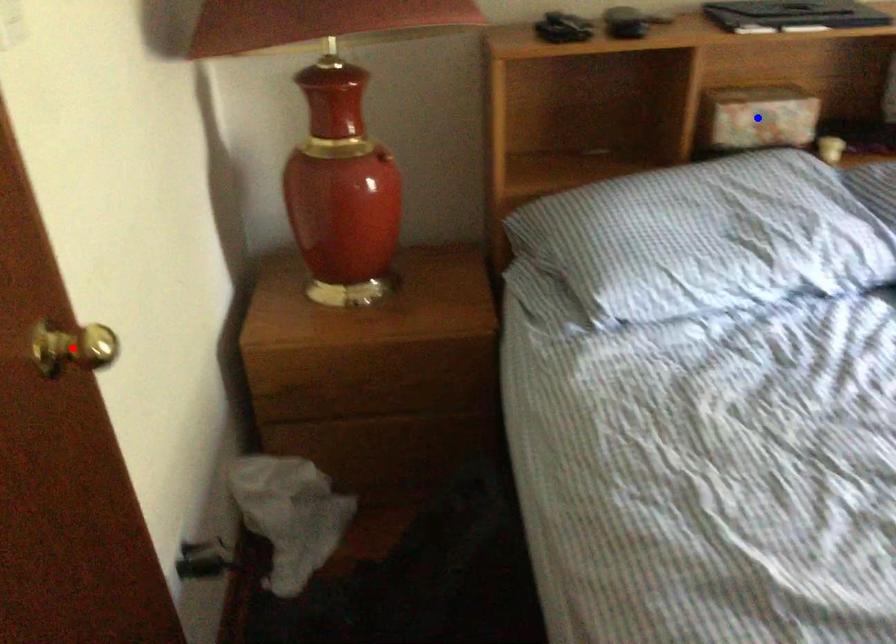
Question: Which of the two points in the image is closer to the camera?

Choices:
 (A) Blue point is closer.
 (B) Red point is closer.

Answer: (B)